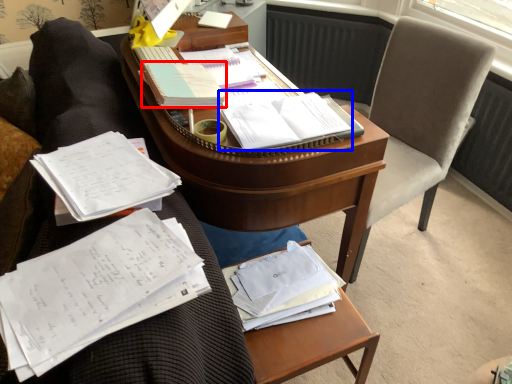
Question: Which object appears farthest to the camera in this image, book (highlighted by a red box) or book (highlighted by a blue box)?

Choices:
 (A) book
 (B) book

Answer: (A)